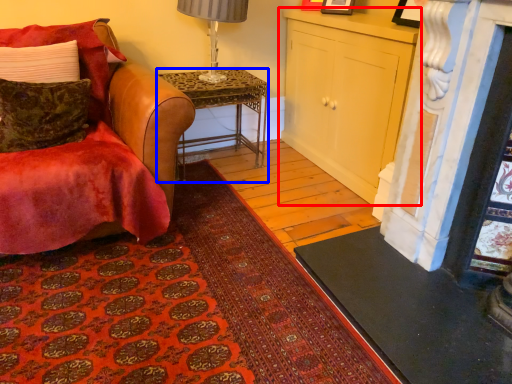
Question: Which point is closer to the camera, cabinetry (highlighted by a red box) or desk (highlighted by a blue box)?

Choices:
 (A) cabinetry
 (B) desk

Answer: (A)